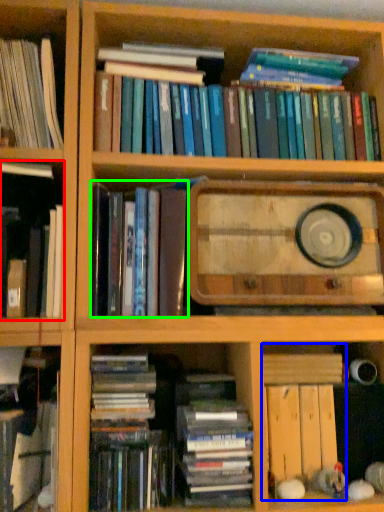
Question: Considering the real-world distances, which object is farthest from book (highlighted by a red box)? book (highlighted by a blue box) or book (highlighted by a green box)?

Choices:
 (A) book
 (B) book

Answer: (A)